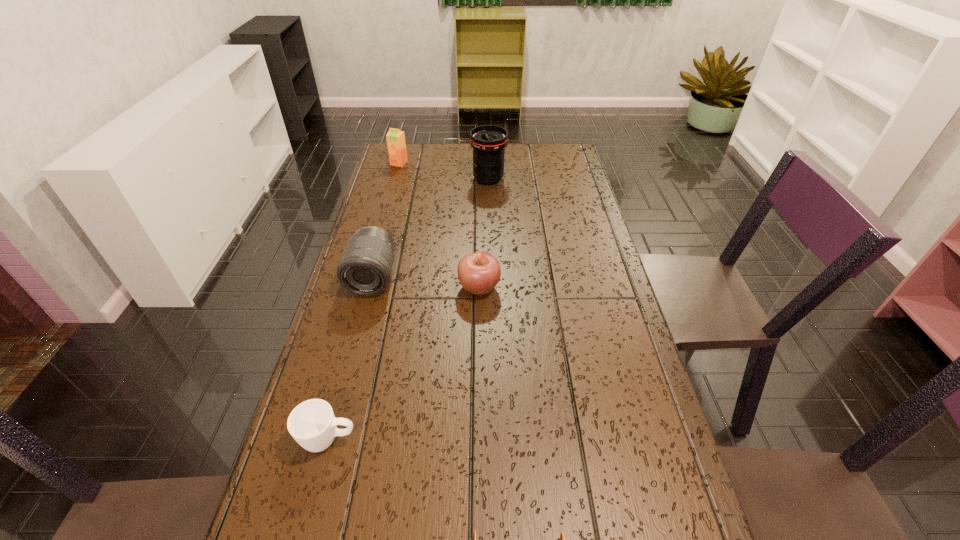
Locate an element on the screen. free space at the left edge of the desktop is located at coordinates (374, 312).

You are a GUI agent. You are given a task and a screenshot of the screen. Output one action in this format:
    pyautogui.click(x=<x>, y=<y>)
    Task: Click on the vacant space at the right edge of the desktop
    The width and height of the screenshot is (960, 540).
    Given the screenshot: What is the action you would take?
    pyautogui.click(x=603, y=314)

Identify the location of free point at the far left corner. Image resolution: width=960 pixels, height=540 pixels. (420, 172).

The height and width of the screenshot is (540, 960). What are the coordinates of `free spot between the nearer telephoto lens and the second farthest object` in the screenshot? It's located at (430, 228).

You are a GUI agent. You are given a task and a screenshot of the screen. Output one action in this format:
    pyautogui.click(x=<x>, y=<y>)
    Task: Click on the vacant space that's between the shorter telephoto lens and the tallest object
    The image size is (960, 540).
    Given the screenshot: What is the action you would take?
    pyautogui.click(x=430, y=228)

Locate an element on the screen. empty location between the farthest object and the fifth farthest object is located at coordinates (364, 302).

The width and height of the screenshot is (960, 540). Find the location of `unoccupied area between the right telephoto lens and the cup`. unoccupied area between the right telephoto lens and the cup is located at coordinates (409, 309).

Locate which object ranks second in proximity to the nearest object. Please provide its 2D coordinates. Your answer should be formatted as a tuple, i.e. [(x, y)], where the tuple contains the x and y coordinates of a point satisfying the conditions above.

[(479, 272)]

Identify the location of object that is the closest to the nearer telephoto lens. The image size is (960, 540). (479, 272).